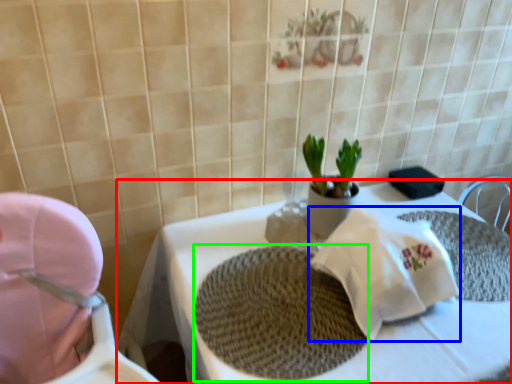
Question: Which object is the farthest from table (highlighted by a red box)? Choose among these: material (highlighted by a blue box) or place mat (highlighted by a green box).

Choices:
 (A) material
 (B) place mat

Answer: (A)